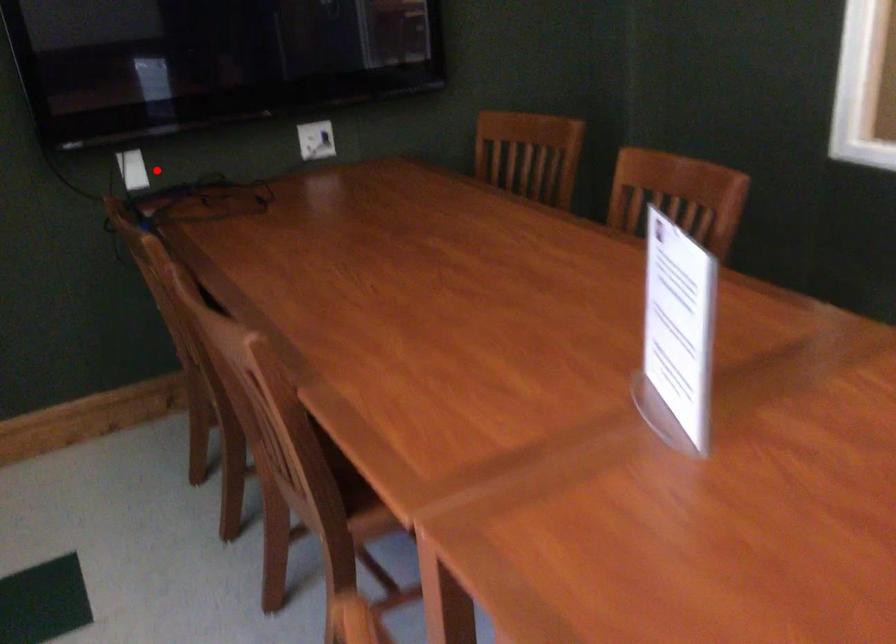
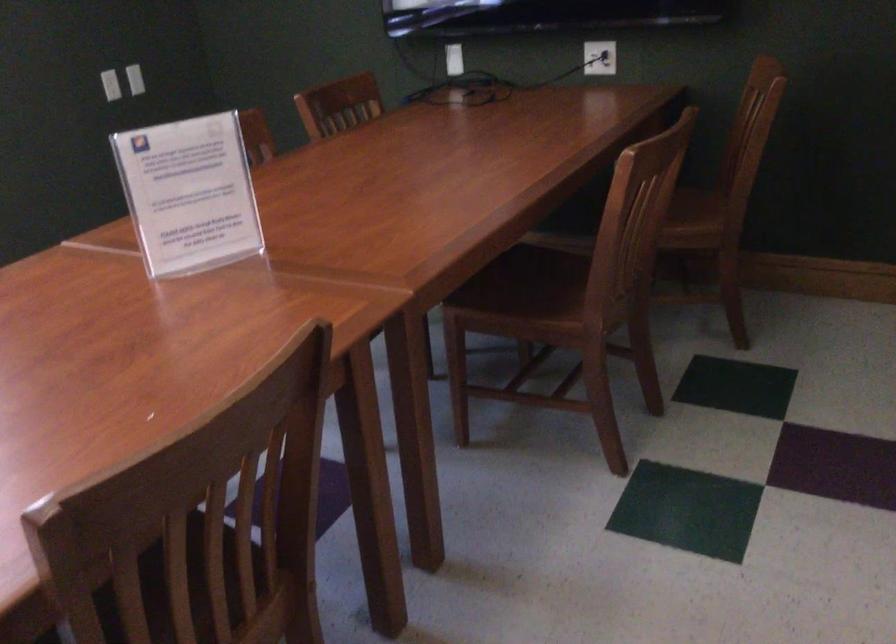
Question: I am providing you with two images of the same scene from different viewpoints. In image1, a red point is highlighted. Considering the same 3D point in image2, which of the following is correct?

Choices:
 (A) It is closer
 (B) It is farther

Answer: (B)